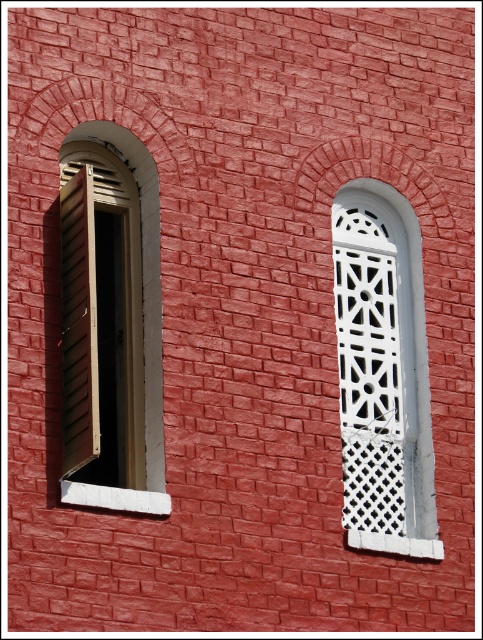
Question: Does white lattice at center appear on the right side of wooden slats at left?

Choices:
 (A) yes
 (B) no

Answer: (A)

Question: Can you confirm if white lattice at center is thinner than wooden slats at left?

Choices:
 (A) no
 (B) yes

Answer: (B)

Question: Which point is closer to the camera?

Choices:
 (A) wooden slats at left
 (B) white lattice at center

Answer: (A)

Question: Can you confirm if white lattice at center is bigger than wooden slats at left?

Choices:
 (A) yes
 (B) no

Answer: (B)

Question: Among these points, which one is nearest to the camera?

Choices:
 (A) (152, 225)
 (B) (395, 220)

Answer: (A)